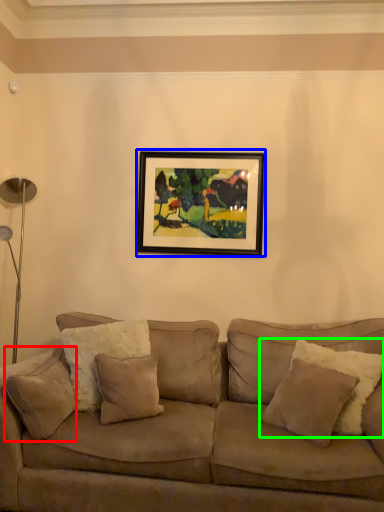
Question: Estimate the real-world distances between objects in this image. Which object is farther from pillow (highlighted by a red box), picture frame (highlighted by a blue box) or pillow (highlighted by a green box)?

Choices:
 (A) picture frame
 (B) pillow

Answer: (A)